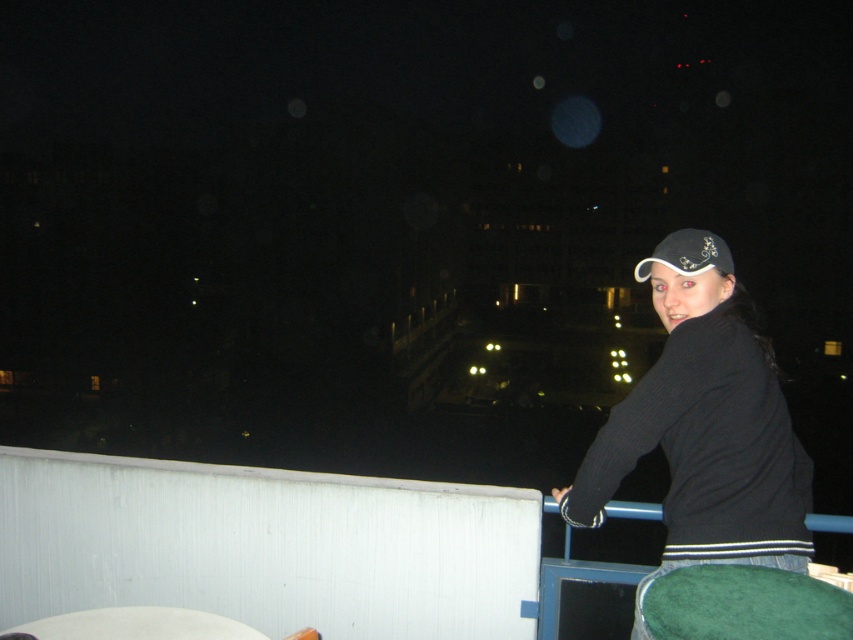
Can you confirm if black ribbed sweater at upper right is positioned above black fabric cap at upper right?

No, black ribbed sweater at upper right is not above black fabric cap at upper right.

Is black ribbed sweater at upper right below black fabric cap at upper right?

Yes, black ribbed sweater at upper right is below black fabric cap at upper right.

This screenshot has width=853, height=640. Identify the location of black ribbed sweater at upper right. (704, 426).